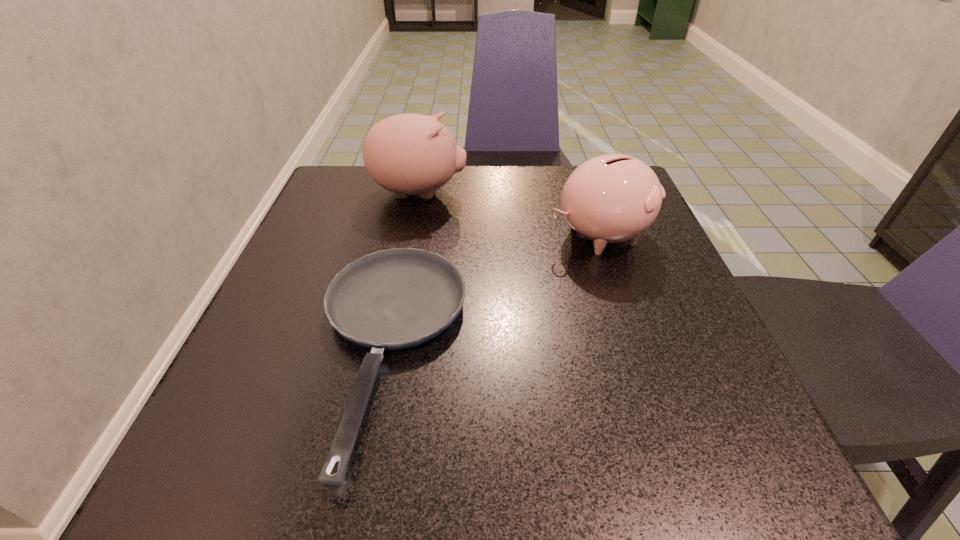
Find the location of a particular element. The height and width of the screenshot is (540, 960). the left piggy bank is located at coordinates (408, 154).

Locate an element on the screen. The height and width of the screenshot is (540, 960). the right piggy bank is located at coordinates (611, 198).

The image size is (960, 540). What are the coordinates of `frying pan` in the screenshot? It's located at (392, 299).

You are a GUI agent. You are given a task and a screenshot of the screen. Output one action in this format:
    pyautogui.click(x=<x>, y=<y>)
    Task: Click on the vacant space located 0.390m at the snout of the left piggy bank
    The image size is (960, 540).
    Given the screenshot: What is the action you would take?
    pyautogui.click(x=633, y=193)

This screenshot has height=540, width=960. Find the location of `vacant space located on the front of the right piggy bank`. vacant space located on the front of the right piggy bank is located at coordinates (667, 434).

Locate an element on the screen. The image size is (960, 540). free space located 0.380m on the back of the shortest object is located at coordinates (424, 166).

Locate an element on the screen. object present at the near edge is located at coordinates (392, 299).

Identify the location of piggy bank situated at the left edge. The height and width of the screenshot is (540, 960). point(408,154).

I want to click on frying pan present at the left edge, so click(392, 299).

Find the location of a particular element. The height and width of the screenshot is (540, 960). object present at the right edge is located at coordinates (611, 198).